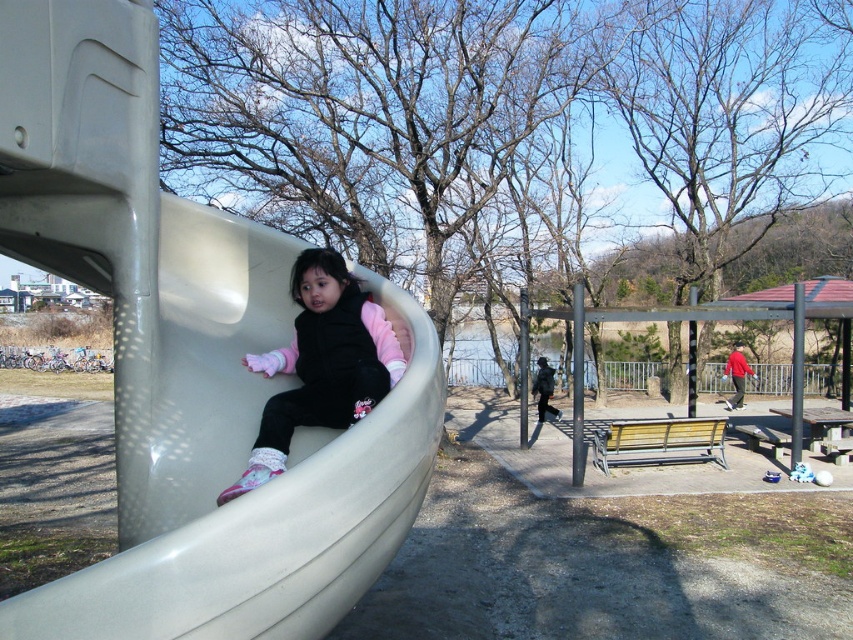
You are a parent trying to locate your child wearing a matte pink sweater at center. You are standing near the smooth plastic slide at left. Which direction should you move to find them?

You should move away from the smooth plastic slide at left because the matte pink sweater at center is further away from you than the slide.